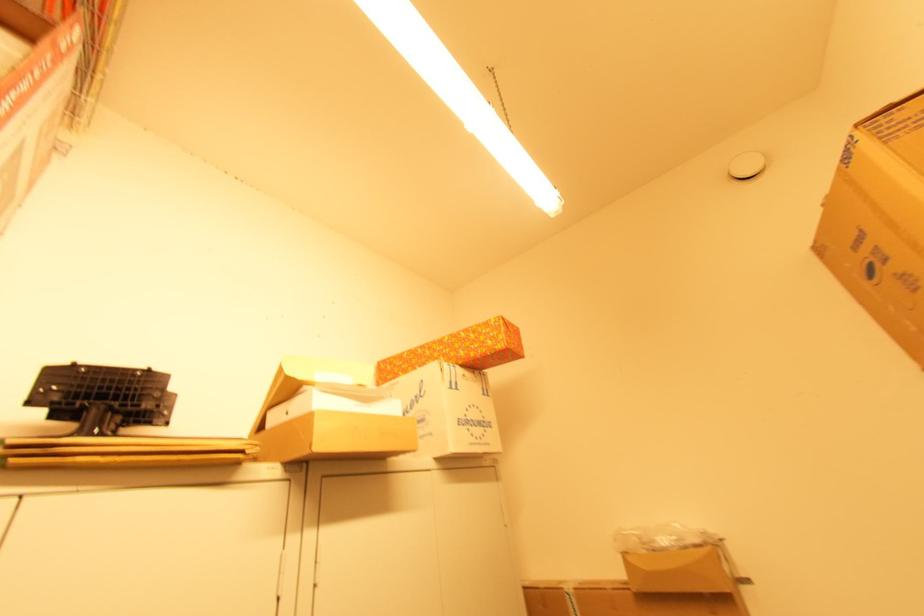
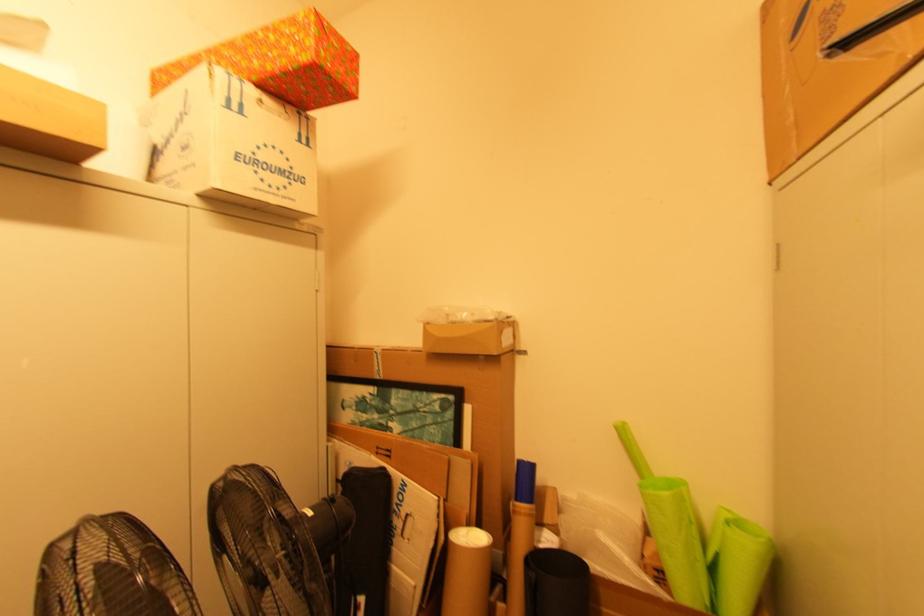
Find the pixel in the second image that matches [468,416] in the first image.

(257, 154)